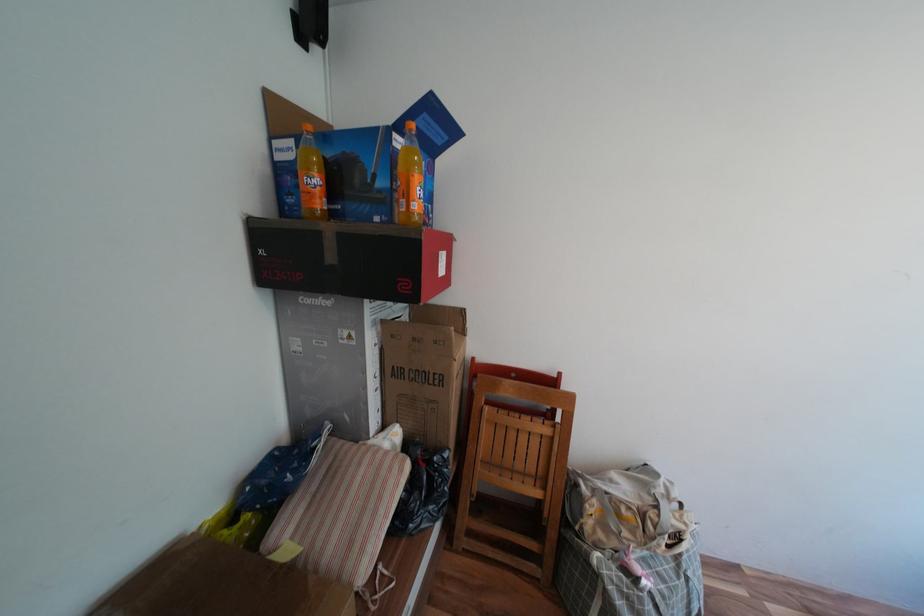
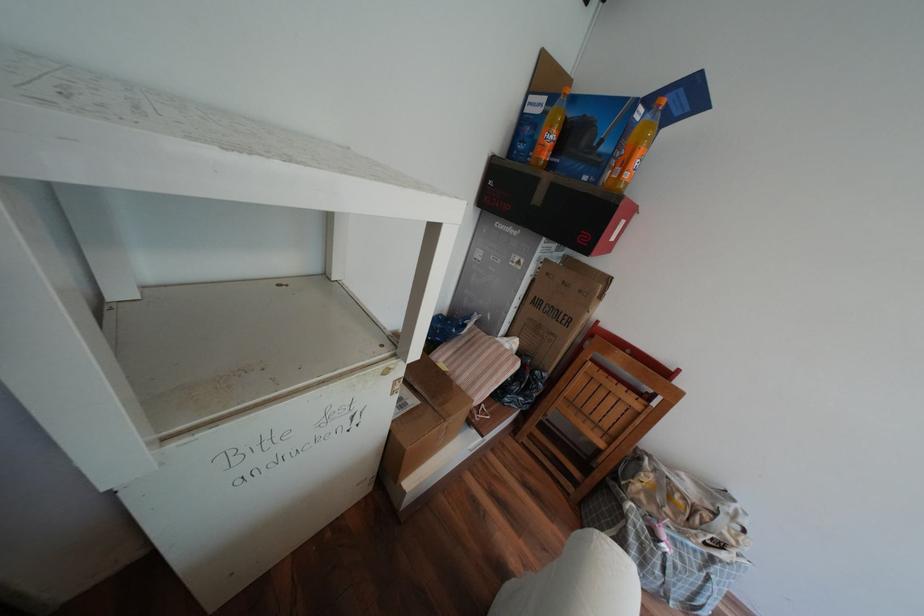
Question: I am providing you with two images of the same scene from different viewpoints. After the viewpoint changes to image2, which objects are now occluded?

Choices:
 (A) brown cardboard box
 (B) black cardboard box
 (C) orange bottle cap
 (D) none of these

Answer: (D)